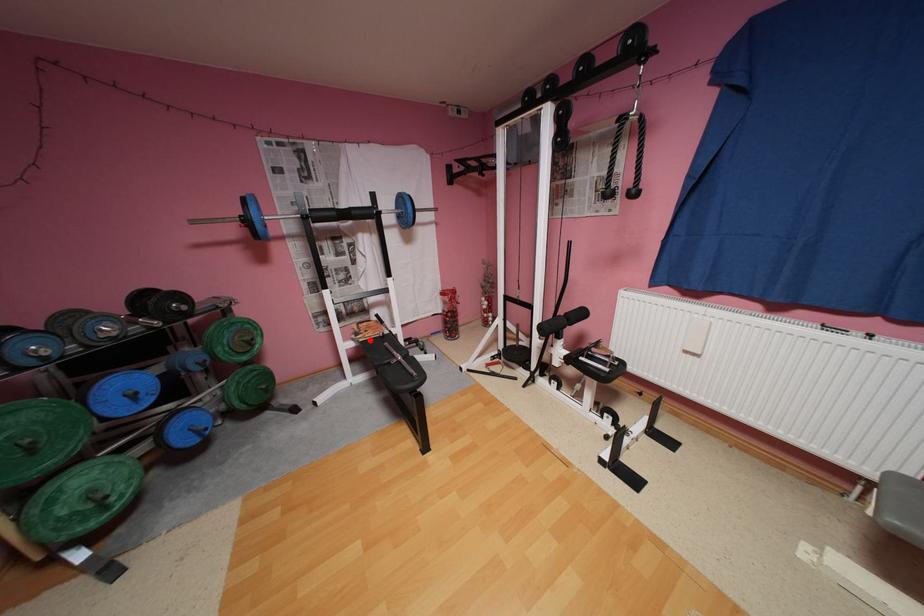
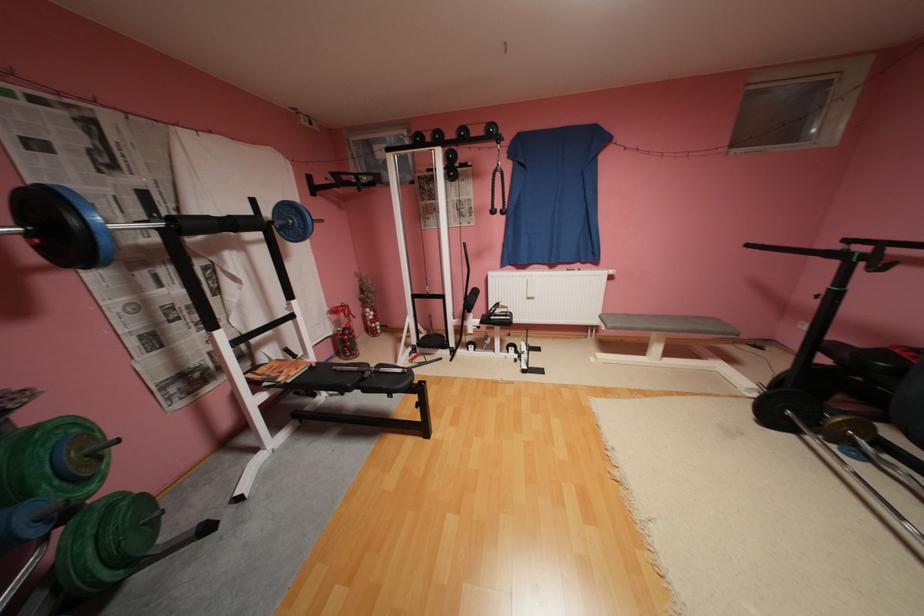
The point at the highlighted location is marked in the first image. Where is the corresponding point in the second image?

(298, 381)